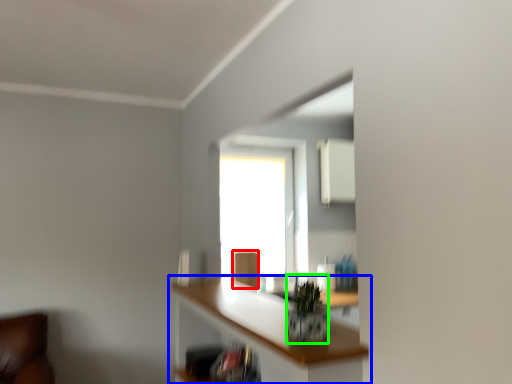
Question: Which is farther away from swivel chair (highlighted by a red box)? shelf (highlighted by a blue box) or plant (highlighted by a green box)?

Choices:
 (A) shelf
 (B) plant

Answer: (B)